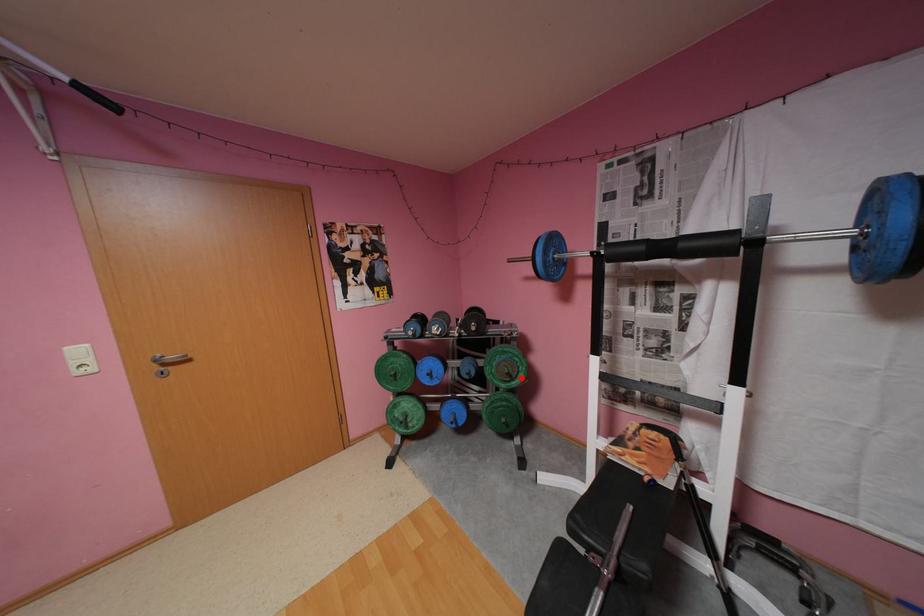
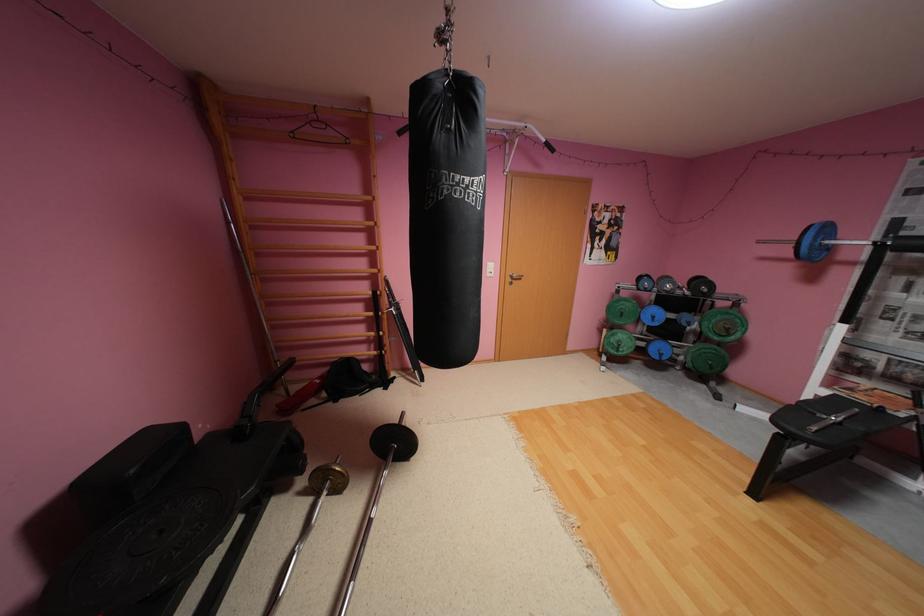
Question: I am providing you with two images of the same scene from different viewpoints. A red point is shown in image1. For the corresponding object point in image2, is it positioned nearer or farther from the camera?

Choices:
 (A) Nearer
 (B) Farther

Answer: (A)